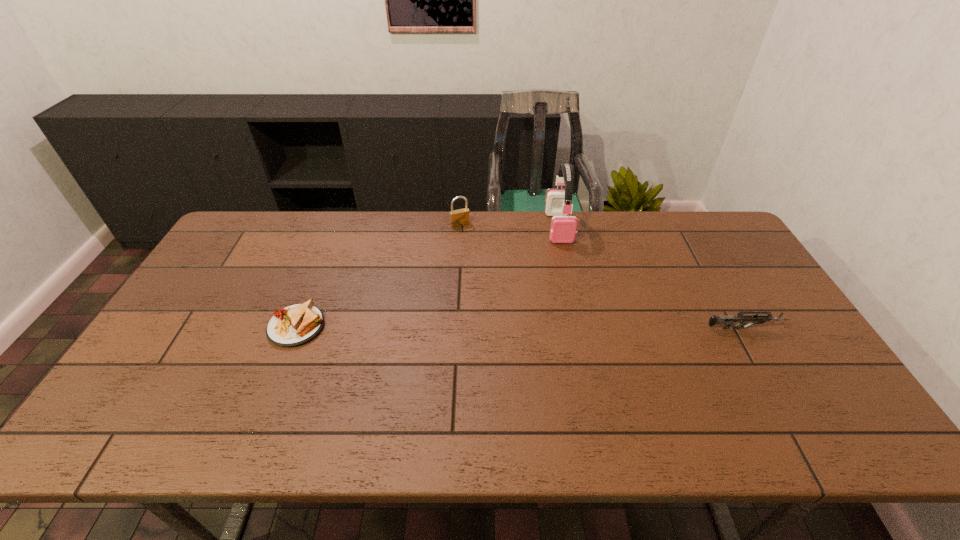
The image size is (960, 540). In order to click on vacant space at the left edge in this screenshot , I will do `click(179, 315)`.

This screenshot has height=540, width=960. Identify the location of vacant space at the right edge of the desktop. (804, 363).

The width and height of the screenshot is (960, 540). In order to click on vacant area at the near left corner in this screenshot , I will do `click(148, 380)`.

Locate an element on the screen. The height and width of the screenshot is (540, 960). vacant space at the far right corner is located at coordinates (697, 235).

The image size is (960, 540). I want to click on vacant position at the near right corner of the desktop, so click(783, 374).

Identify the location of vacant space in between the padlock and the third object from left to right. (510, 226).

The height and width of the screenshot is (540, 960). Find the location of `free area in between the rightmost object and the third shortest object`. free area in between the rightmost object and the third shortest object is located at coordinates [602, 276].

Where is `vacant area that lies between the second object from left to right and the rightmost object`? Image resolution: width=960 pixels, height=540 pixels. vacant area that lies between the second object from left to right and the rightmost object is located at coordinates (602, 276).

Identify the location of vacant space in between the padlock and the sandwich. The height and width of the screenshot is (540, 960). (378, 275).

Image resolution: width=960 pixels, height=540 pixels. What are the coordinates of `free space between the gun and the third shortest object` in the screenshot? It's located at (602, 276).